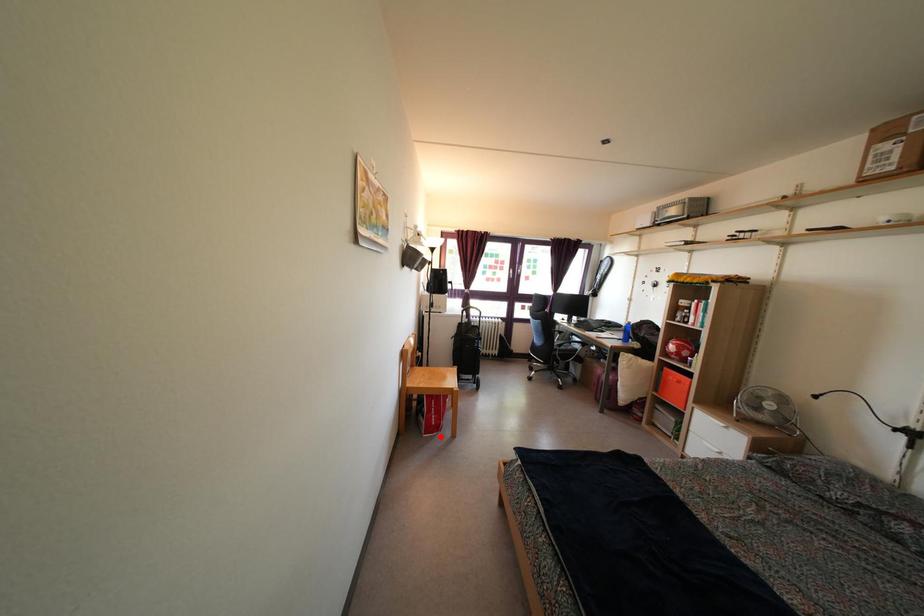
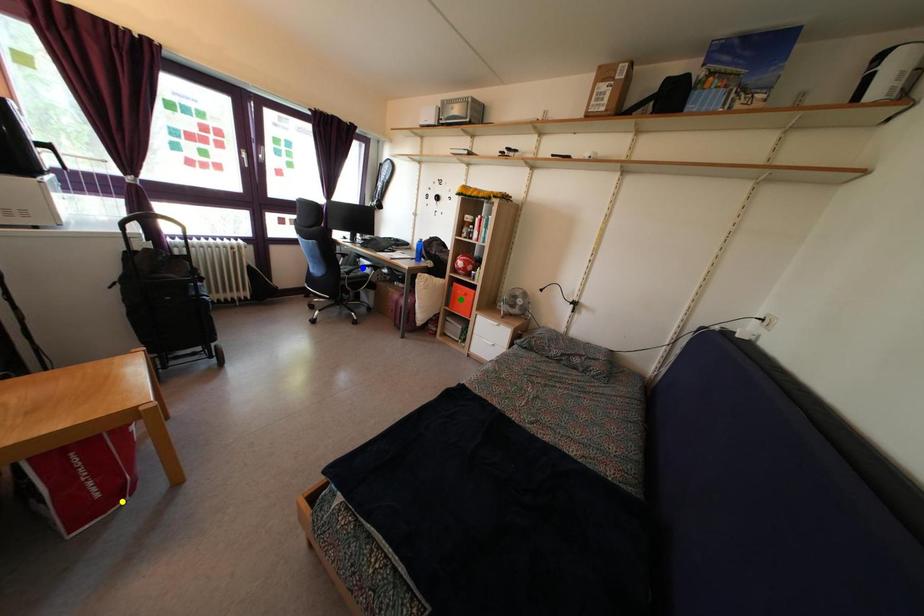
Question: I am providing you with two images of the same scene from different viewpoints. A red point is marked on the first image. You are given multiple points on the second image. Can you choose the point in image 2 that corresponds to the point in image 1?

Choices:
 (A) yellow point
 (B) blue point
 (C) green point

Answer: (A)